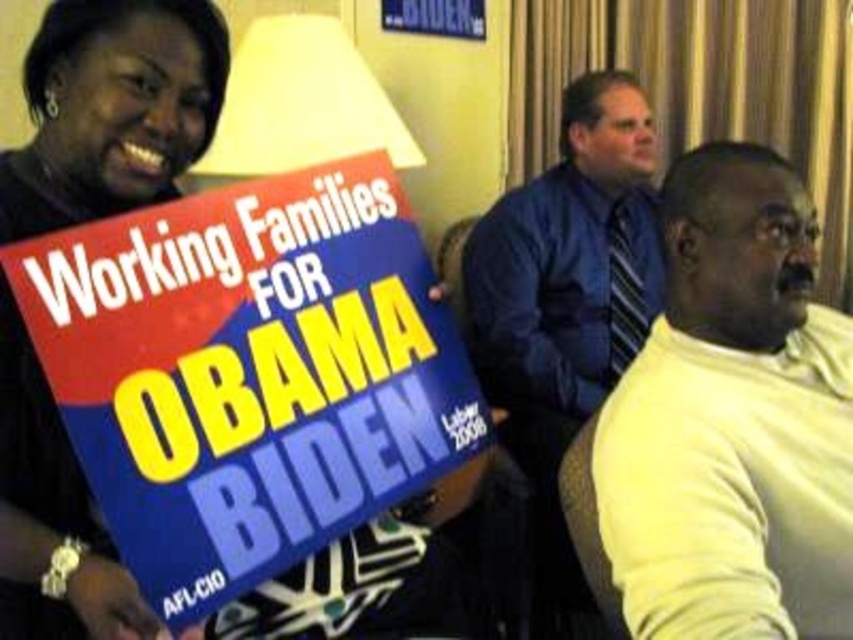
You are standing at the center of the image and want to greet the person in the yellow sweater at right. In which direction should you move to approach them?

The yellow sweater at right is located at point 0.658 on the x axis and 0.859 on the y axis. Since you are at the center, you should move towards the right and slightly upwards to reach the yellow sweater at right.

You are a photographer adjusting your camera settings. You notice the yellow sweater at right and the matte black sign at upper left in your frame. Considering their distance, can you estimate if they are within the camera focus range of 30 inches?

The yellow sweater at right is 31.42 inches away from the matte black sign at upper left. Since the focus range is 30 inches, they are slightly out of focus range and might not be in sharp focus simultaneously.

You are organizing a photo shoot and need to arrange the yellow sweater at right and the blue fabric shirt at center based on their heights. Which one should you place higher up to ensure proper visibility?

The yellow sweater at right is shorter than the blue fabric shirt at center, so placing the blue fabric shirt at center higher up will ensure proper visibility since it is taller.